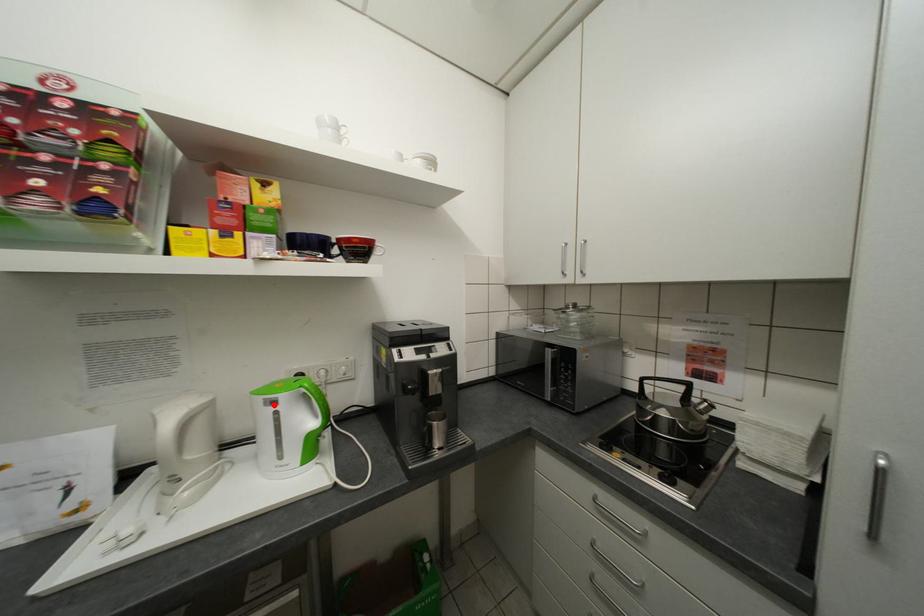
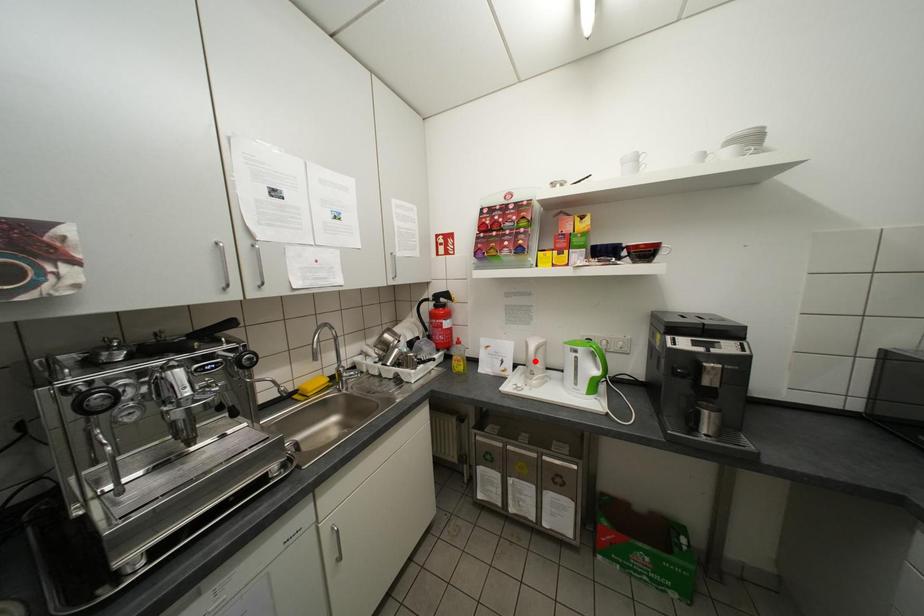
I am providing you with two images of the same scene from different viewpoints. A red point is marked on the first image and another point is marked on the second image. Is the marked point in image1 the same physical position as the marked point in image2?

No